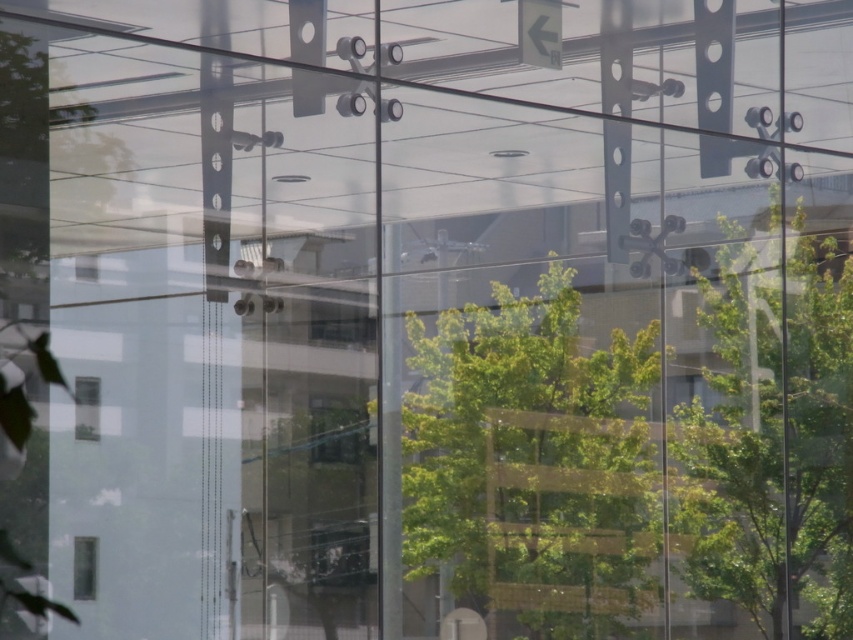
Question: From the image, what is the correct spatial relationship of green leafy tree at left in relation to transparent glass window at lower left?

Choices:
 (A) above
 (B) below

Answer: (A)

Question: Which of the following is the farthest from the observer?

Choices:
 (A) green leafy tree at left
 (B) transparent glass window at lower left

Answer: (B)

Question: Which point is farther from the camera taking this photo?

Choices:
 (A) (38, 486)
 (B) (73, 584)
 (C) (811, 316)
 (D) (461, 592)

Answer: (C)

Question: Considering the real-world distances, which object is farthest from the transparent glass window at lower left?

Choices:
 (A) clear glass window at lower left
 (B) green leafy tree at left
 (C) green leafy tree at center

Answer: (C)

Question: Is green leafy tree at left to the right of transparent glass window at lower left from the viewer's perspective?

Choices:
 (A) no
 (B) yes

Answer: (A)

Question: Can you confirm if green leafy tree at center is wider than clear glass window at lower left?

Choices:
 (A) yes
 (B) no

Answer: (A)